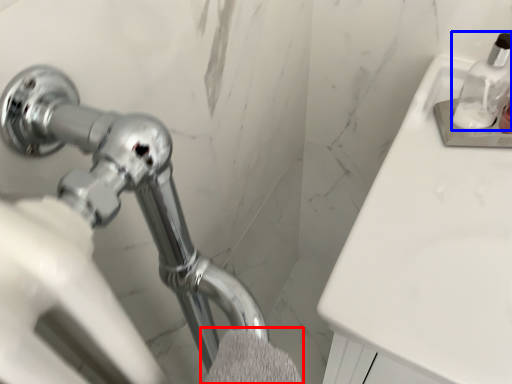
Question: Which object is further to the camera taking this photo, bath towel (highlighted by a red box) or soap dispenser (highlighted by a blue box)?

Choices:
 (A) bath towel
 (B) soap dispenser

Answer: (B)